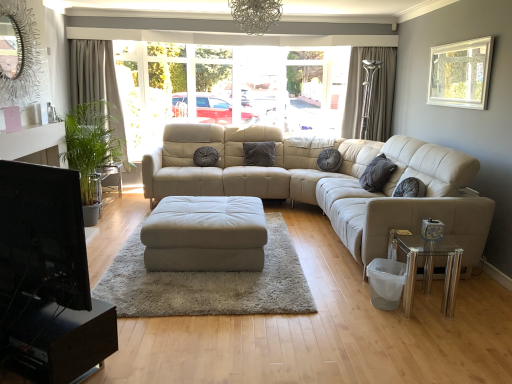
Question: Does beige fabric curtain at left, placed as the second curtain when sorted from right to left, appear on the right side of silky gray curtain at right, which is the 2th curtain in left-to-right order?

Choices:
 (A) yes
 (B) no

Answer: (B)

Question: From a real-world perspective, is beige fabric curtain at left, which is counted as the 1th curtain, starting from the left, under silky gray curtain at right, which appears as the 1th curtain when viewed from the right?

Choices:
 (A) no
 (B) yes

Answer: (B)

Question: Is beige fabric curtain at left, which is counted as the 1th curtain, starting from the left, positioned beyond the bounds of silky gray curtain at right, which appears as the 1th curtain when viewed from the right?

Choices:
 (A) no
 (B) yes

Answer: (B)

Question: Considering the relative sizes of beige fabric curtain at left, which is counted as the 1th curtain, starting from the left, and silky gray curtain at right, which is the 2th curtain in left-to-right order, in the image provided, is beige fabric curtain at left, which is counted as the 1th curtain, starting from the left, taller than silky gray curtain at right, which is the 2th curtain in left-to-right order,?

Choices:
 (A) yes
 (B) no

Answer: (A)

Question: Does beige fabric curtain at left, placed as the second curtain when sorted from right to left, contain silky gray curtain at right, which appears as the 1th curtain when viewed from the right?

Choices:
 (A) no
 (B) yes

Answer: (A)

Question: Is point (406, 306) positioned closer to the camera than point (79, 96)?

Choices:
 (A) closer
 (B) farther

Answer: (A)

Question: Considering their positions, is transparent glass table at lower right located in front of or behind beige fabric curtain at left, which is counted as the 1th curtain, starting from the left?

Choices:
 (A) front
 (B) behind

Answer: (A)

Question: Is transparent glass table at lower right bigger or smaller than beige fabric curtain at left, which is counted as the 1th curtain, starting from the left?

Choices:
 (A) big
 (B) small

Answer: (B)

Question: In terms of height, does transparent glass table at lower right look taller or shorter compared to beige fabric curtain at left, which is counted as the 1th curtain, starting from the left?

Choices:
 (A) short
 (B) tall

Answer: (A)

Question: From a real-world perspective, is white leather ottoman at center above or below beige fabric curtain at left, which is counted as the 1th curtain, starting from the left?

Choices:
 (A) above
 (B) below

Answer: (B)

Question: Is white leather ottoman at center taller or shorter than beige fabric curtain at left, which is counted as the 1th curtain, starting from the left?

Choices:
 (A) short
 (B) tall

Answer: (A)

Question: Considering the positions of point (261, 248) and point (116, 152), is point (261, 248) closer or farther from the camera than point (116, 152)?

Choices:
 (A) farther
 (B) closer

Answer: (B)

Question: Is white leather ottoman at center situated inside beige fabric curtain at left, placed as the second curtain when sorted from right to left, or outside?

Choices:
 (A) outside
 (B) inside

Answer: (A)

Question: In terms of height, does white glossy side table at left look taller or shorter compared to transparent glass table at lower right?

Choices:
 (A) tall
 (B) short

Answer: (B)

Question: From the image's perspective, is white glossy side table at left located above or below transparent glass table at lower right?

Choices:
 (A) below
 (B) above

Answer: (B)